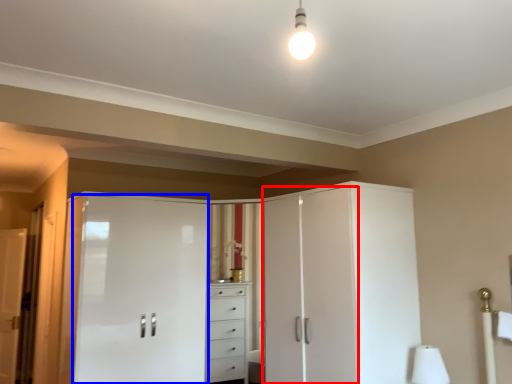
Question: Which object appears farthest to the camera in this image, screen door (highlighted by a red box) or screen door (highlighted by a blue box)?

Choices:
 (A) screen door
 (B) screen door

Answer: (B)